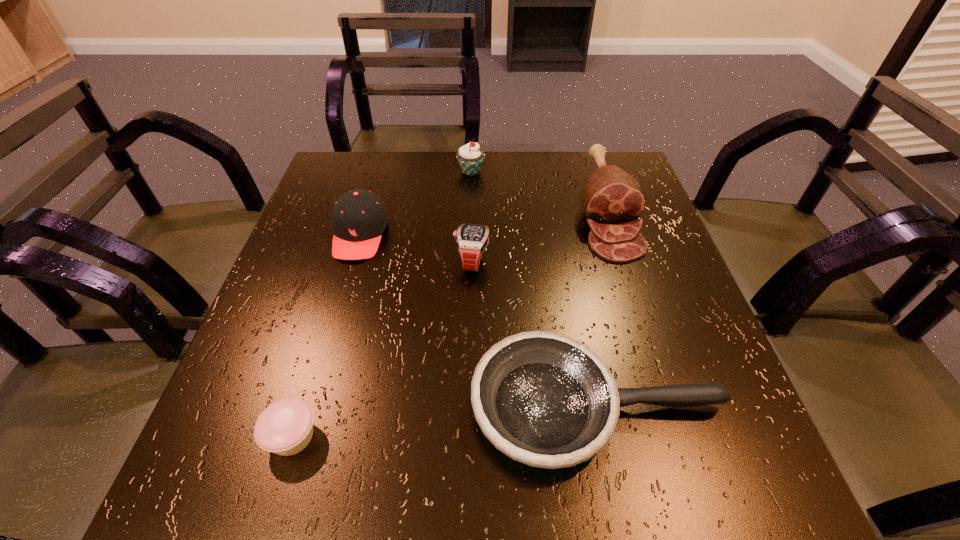
Locate an element on the screen. frying pan located at the right edge is located at coordinates (544, 399).

Locate an element on the screen. object present at the near left corner is located at coordinates (285, 427).

Where is `object positioned at the far right corner`? This screenshot has width=960, height=540. object positioned at the far right corner is located at coordinates (613, 201).

The image size is (960, 540). In order to click on object present at the near right corner in this screenshot , I will do `click(544, 399)`.

The width and height of the screenshot is (960, 540). In the image, there is a desktop. What are the coordinates of `free region at the far edge` in the screenshot? It's located at (413, 157).

Identify the location of vacant space at the near edge. This screenshot has height=540, width=960. (607, 451).

The image size is (960, 540). I want to click on vacant space at the left edge, so click(324, 290).

In the image, there is a desktop. At what (x,y) coordinates should I click in order to perform the action: click on vacant space at the right edge. Please return your answer as a coordinate pair (x, y). This screenshot has height=540, width=960. Looking at the image, I should click on (664, 433).

In order to click on blank space at the far left corner of the desktop in this screenshot , I will do `click(367, 158)`.

Locate an element on the screen. vacant space at the near right corner of the desktop is located at coordinates (693, 488).